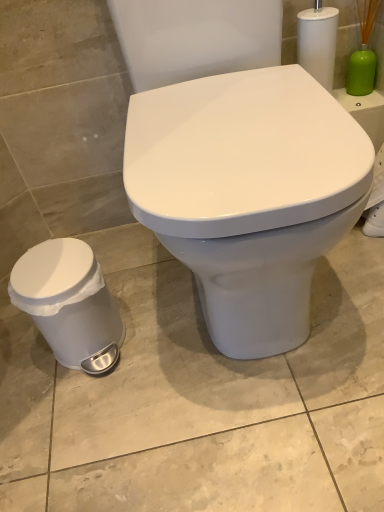
Question: Is white plastic trash can at lower left to the right of green matte brush at upper right from the viewer's perspective?

Choices:
 (A) no
 (B) yes

Answer: (A)

Question: Can you confirm if white plastic trash can at lower left is smaller than green matte brush at upper right?

Choices:
 (A) no
 (B) yes

Answer: (A)

Question: Could green matte brush at upper right be considered to be inside white plastic trash can at lower left?

Choices:
 (A) yes
 (B) no

Answer: (B)

Question: Does white plastic trash can at lower left have a greater height compared to green matte brush at upper right?

Choices:
 (A) yes
 (B) no

Answer: (A)

Question: Is there a large distance between white plastic trash can at lower left and green matte brush at upper right?

Choices:
 (A) yes
 (B) no

Answer: (B)

Question: Is white plastic trash can at lower left shorter than green matte brush at upper right?

Choices:
 (A) no
 (B) yes

Answer: (A)

Question: Does green matte brush at upper right have a smaller size compared to white glossy toilet at center?

Choices:
 (A) yes
 (B) no

Answer: (A)

Question: Considering the relative sizes of green matte brush at upper right and white glossy toilet at center in the image provided, is green matte brush at upper right shorter than white glossy toilet at center?

Choices:
 (A) yes
 (B) no

Answer: (A)

Question: Is green matte brush at upper right at the left side of white glossy toilet at center?

Choices:
 (A) no
 (B) yes

Answer: (A)

Question: Considering the relative positions of green matte brush at upper right and white glossy toilet at center in the image provided, is green matte brush at upper right to the right of white glossy toilet at center from the viewer's perspective?

Choices:
 (A) yes
 (B) no

Answer: (A)

Question: Is green matte brush at upper right thinner than white glossy toilet at center?

Choices:
 (A) yes
 (B) no

Answer: (A)

Question: Considering the relative sizes of green matte brush at upper right and white glossy toilet at center in the image provided, is green matte brush at upper right wider than white glossy toilet at center?

Choices:
 (A) yes
 (B) no

Answer: (B)

Question: Are white plastic trash can at lower left and white glossy toilet at center beside each other?

Choices:
 (A) yes
 (B) no

Answer: (B)